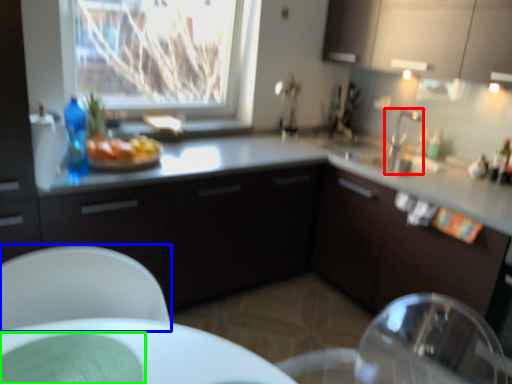
Question: Based on their relative distances, which object is nearer to tap (highlighted by a red box)? Choose from chair (highlighted by a blue box) and glass plate (highlighted by a green box).

Choices:
 (A) chair
 (B) glass plate

Answer: (A)